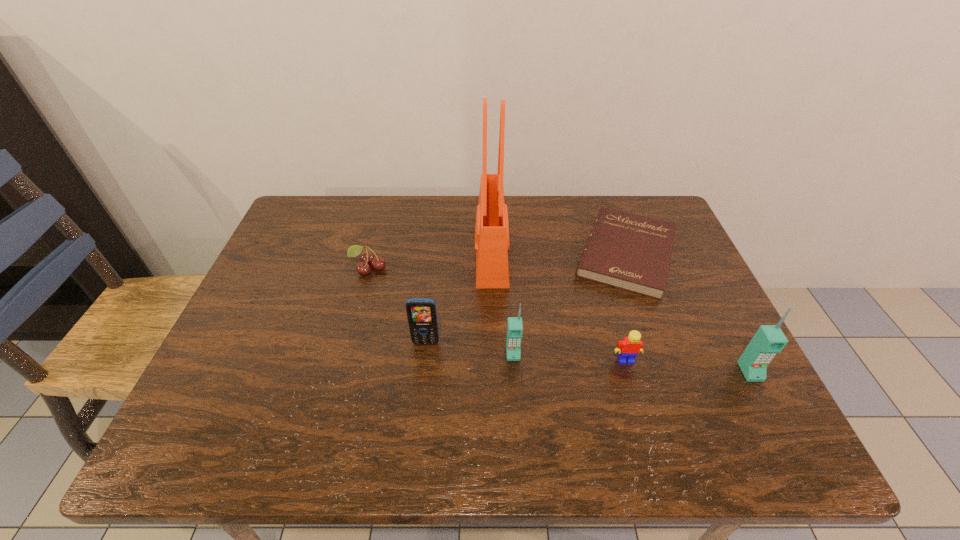
Identify the location of the fifth closest object to the cherry. Image resolution: width=960 pixels, height=540 pixels. (628, 348).

Where is `cellular telephone identified as the second closest to the second cellular telephone from left to right`? The height and width of the screenshot is (540, 960). cellular telephone identified as the second closest to the second cellular telephone from left to right is located at coordinates 769,339.

The height and width of the screenshot is (540, 960). What are the coordinates of `cellular telephone object that ranks as the second closest to the nearest cellular telephone` in the screenshot? It's located at (421, 312).